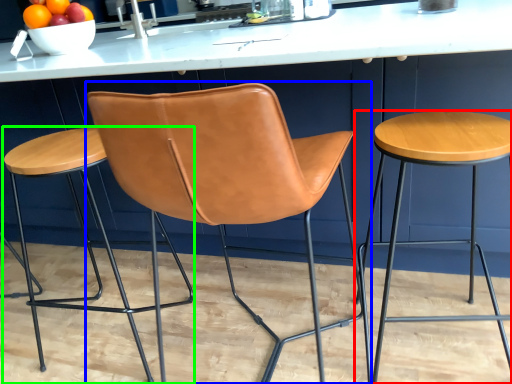
Question: Considering the real-world distances, which object is farthest from stool (highlighted by a red box)? chair (highlighted by a blue box) or stool (highlighted by a green box)?

Choices:
 (A) chair
 (B) stool

Answer: (B)